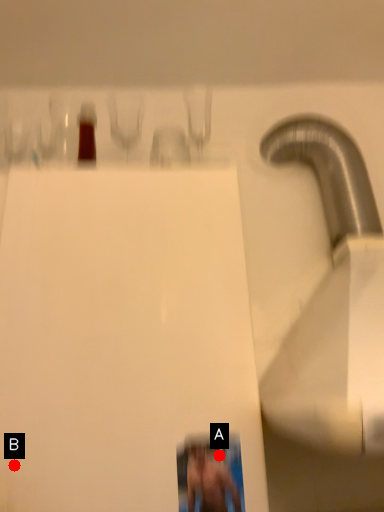
Question: Two points are circled on the image, labeled by A and B beside each circle. Which of the following is the closest to the observer?

Choices:
 (A) A is closer
 (B) B is closer

Answer: (B)